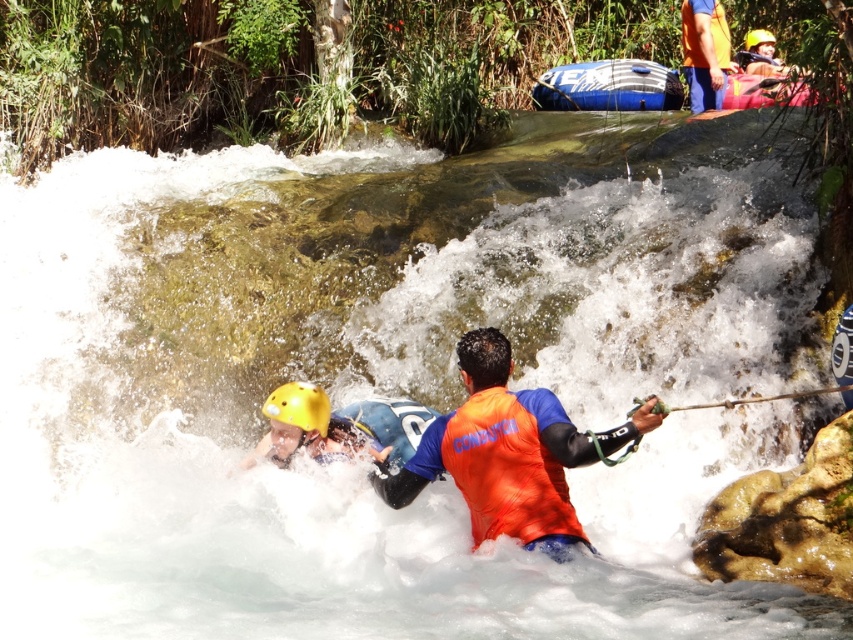
Is the position of orange fabric life vest at center more distant than that of yellow matte helmet at lower left?

No.

Which is above, orange fabric life vest at center or yellow matte helmet at lower left?

yellow matte helmet at lower left

At what (x,y) coordinates should I click in order to perform the action: click on orange fabric life vest at center. Please return your answer as a coordinate pair (x, y). The height and width of the screenshot is (640, 853). Looking at the image, I should click on (500, 454).

Is point (476, 532) positioned before point (798, 392)?

Yes, point (476, 532) is closer to viewer.

Is orange fabric life jacket at center taller than smooth black paddle at center?

Indeed, orange fabric life jacket at center has a greater height compared to smooth black paddle at center.

Which is behind, point (447, 451) or point (833, 387)?

Point (833, 387)

You are a GUI agent. You are given a task and a screenshot of the screen. Output one action in this format:
    pyautogui.click(x=<x>, y=<y>)
    Task: Click on the orange fabric life jacket at center
    The height and width of the screenshot is (640, 853).
    Given the screenshot: What is the action you would take?
    pyautogui.click(x=506, y=465)

Is point (663, 68) less distant than point (718, 45)?

No, (663, 68) is further to viewer.

Does blue inflatable kayak at upper center have a lesser width compared to orange fabric life vest at upper center?

Incorrect, blue inflatable kayak at upper center's width is not less than orange fabric life vest at upper center's.

Locate an element on the screen. blue inflatable kayak at upper center is located at coordinates (608, 86).